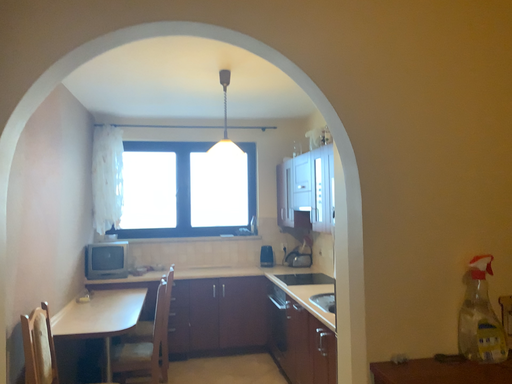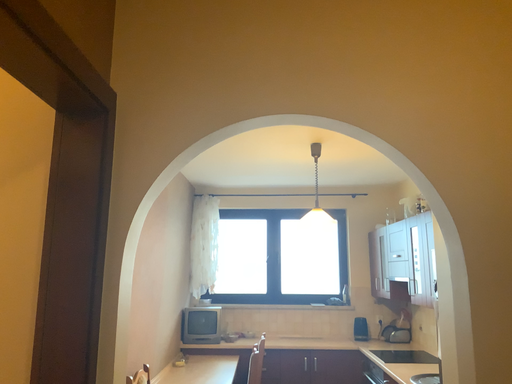
Question: How did the camera likely rotate when shooting the video?

Choices:
 (A) rotated upward
 (B) rotated downward

Answer: (A)